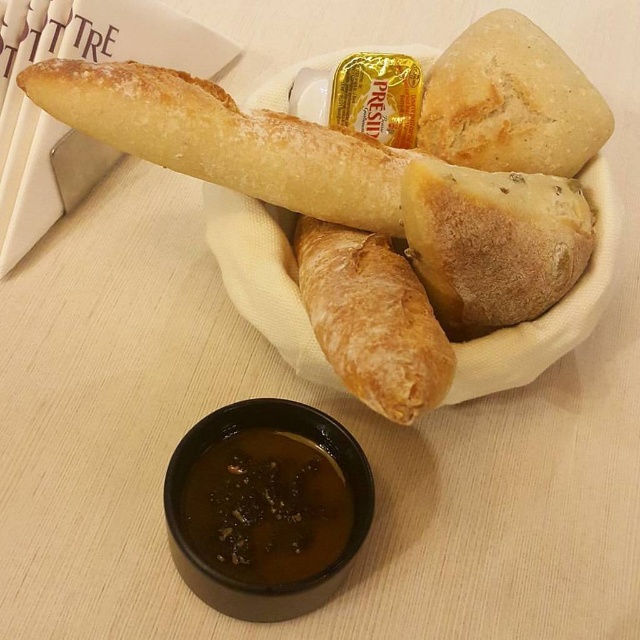
Question: Can you confirm if golden brown crusty bread at upper right is thinner than brown glossy sauce at lower center?

Choices:
 (A) no
 (B) yes

Answer: (A)

Question: Is golden crusty baguette at center closer to the viewer compared to brown glossy sauce at lower center?

Choices:
 (A) yes
 (B) no

Answer: (A)

Question: Among these objects, which one is nearest to the camera?

Choices:
 (A) brown glossy sauce at lower center
 (B) brown crumbly bread at center

Answer: (A)

Question: Is golden crusty baguette at center positioned behind brown crumbly bread at center?

Choices:
 (A) no
 (B) yes

Answer: (A)

Question: Which point appears farthest from the camera in this image?

Choices:
 (A) (301, 444)
 (B) (296, 243)

Answer: (B)

Question: Which object appears farthest from the camera in this image?

Choices:
 (A) brown glossy sauce at lower center
 (B) golden crusty baguette at center
 (C) golden brown crusty bread at center
 (D) brown crumbly bread at center

Answer: (D)